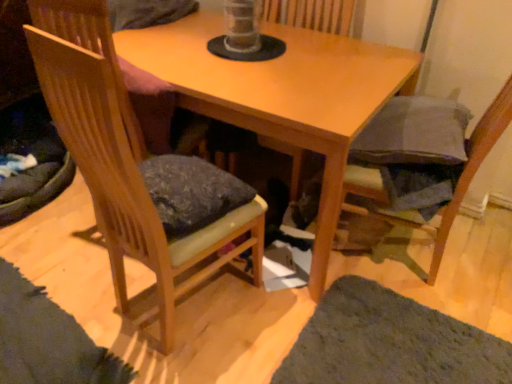
Identify the location of free space behind green shaggy rug at lower right. Image resolution: width=512 pixels, height=384 pixels. (433, 265).